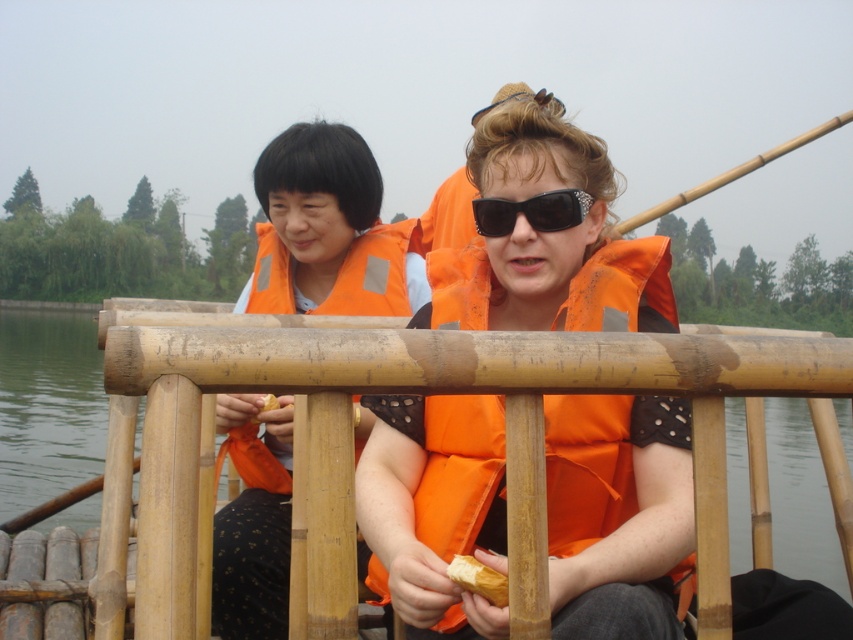
Question: Is orange life vest at center positioned behind orange fabric life jacket at center?

Choices:
 (A) no
 (B) yes

Answer: (A)

Question: Which object is positioned closest to the orange life vest at center?

Choices:
 (A) orange life vest at left
 (B) black textured sunglasses at center
 (C) orange fabric life jacket at center

Answer: (B)

Question: Can you confirm if orange life vest at left is bigger than orange fabric life jacket at center?

Choices:
 (A) yes
 (B) no

Answer: (A)

Question: Is orange life vest at left to the right of black textured sunglasses at center from the viewer's perspective?

Choices:
 (A) no
 (B) yes

Answer: (A)

Question: Estimate the real-world distances between objects in this image. Which object is closer to the orange life vest at left?

Choices:
 (A) black textured sunglasses at center
 (B) orange fabric life jacket at center
 (C) orange life vest at center

Answer: (C)

Question: Which object is farther from the camera taking this photo?

Choices:
 (A) orange life vest at left
 (B) black textured sunglasses at center

Answer: (B)